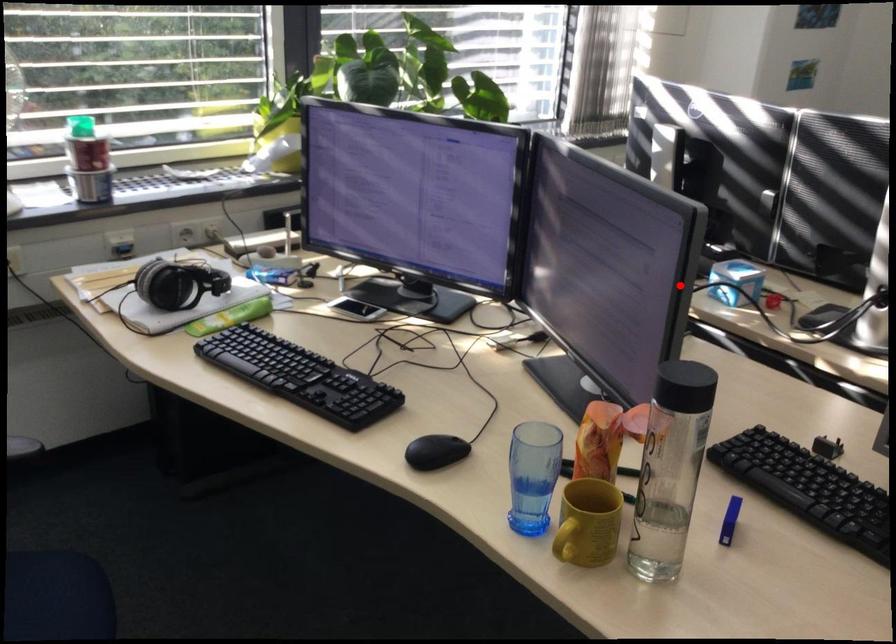
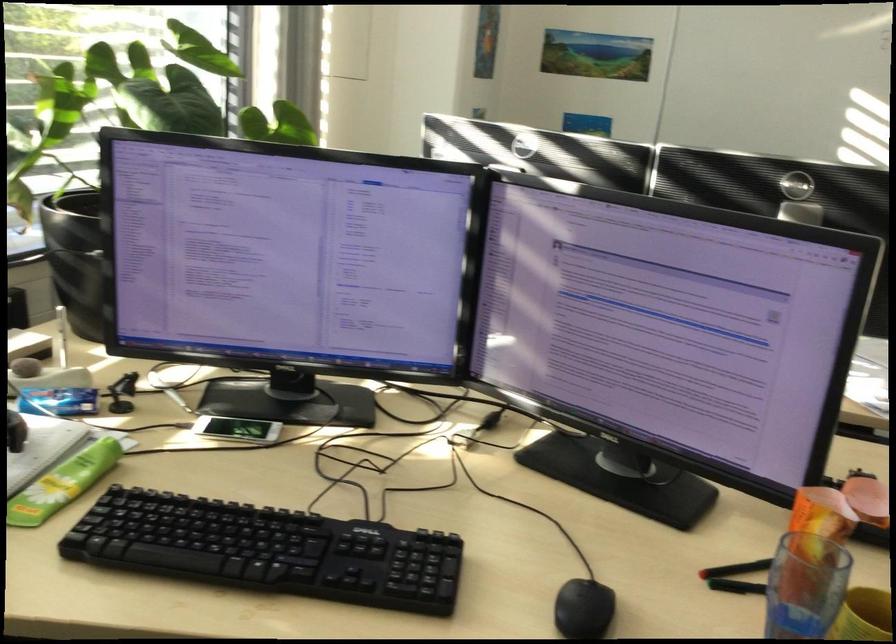
In the second image, find the point that corresponds to the highlighted location in the first image.

(826, 328)